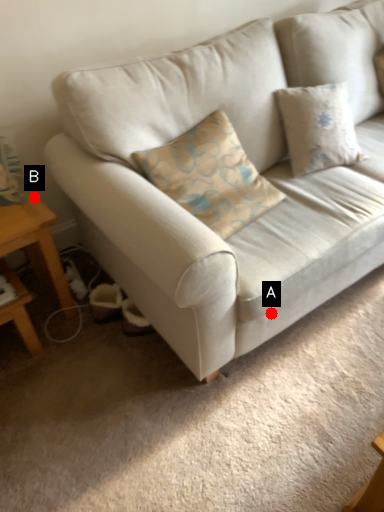
Question: Two points are circled on the image, labeled by A and B beside each circle. Which point is closer to the camera?

Choices:
 (A) A is closer
 (B) B is closer

Answer: (A)